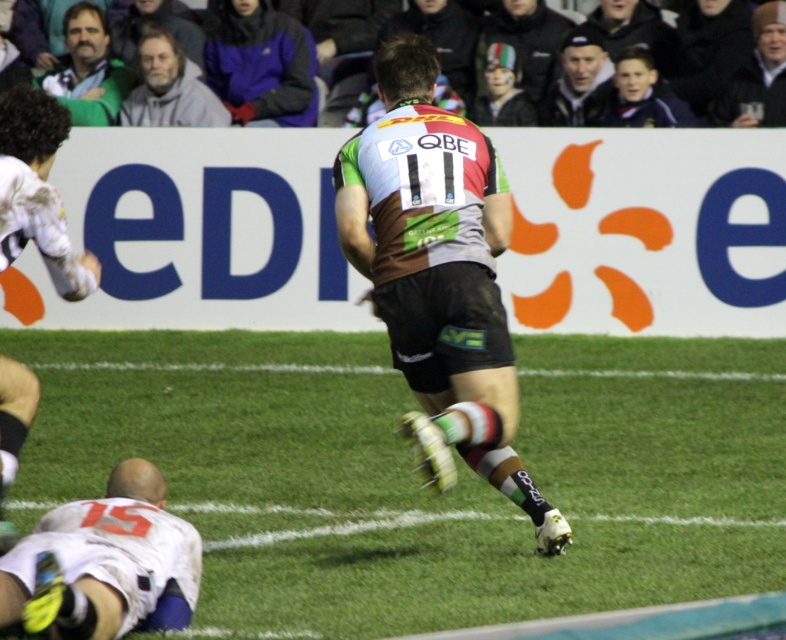
Question: Which object is farther from the camera taking this photo?

Choices:
 (A) brown jersey at center
 (B) green jersey at upper left
 (C) black leather jacket at upper right
 (D) white jersey at left

Answer: (B)

Question: Is the position of white jersey at left less distant than that of gray woolen sweater at upper left?

Choices:
 (A) no
 (B) yes

Answer: (B)

Question: Is white jersey at left wider than green jersey at upper left?

Choices:
 (A) no
 (B) yes

Answer: (A)

Question: Which point is closer to the camera taking this photo?

Choices:
 (A) (141, 74)
 (B) (72, 49)
 (C) (443, 380)
 (D) (197, 593)

Answer: (D)

Question: Can you confirm if brown jersey at center is thinner than white jersey at left?

Choices:
 (A) yes
 (B) no

Answer: (B)

Question: Which point appears farthest from the camera in this image?

Choices:
 (A) (114, 104)
 (B) (134, 122)
 (C) (428, 432)

Answer: (A)